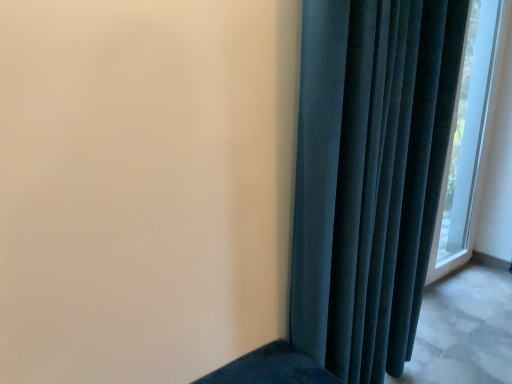
The image size is (512, 384). What do you see at coordinates (369, 176) in the screenshot?
I see `velvet dark blue curtain at right` at bounding box center [369, 176].

Find the location of a particular element. This screenshot has height=384, width=512. velvet dark blue curtain at right is located at coordinates (369, 176).

The width and height of the screenshot is (512, 384). What do you see at coordinates (469, 137) in the screenshot? I see `transparent glass window at right` at bounding box center [469, 137].

Find the location of `transparent glass window at right`. transparent glass window at right is located at coordinates (469, 137).

This screenshot has height=384, width=512. I want to click on velvet dark blue curtain at right, so click(369, 176).

Which is more to the right, velvet dark blue curtain at right or transparent glass window at right?

transparent glass window at right is more to the right.

Which is in front, velvet dark blue curtain at right or transparent glass window at right?

velvet dark blue curtain at right is in front.

Does point (320, 239) appear closer or farther from the camera than point (480, 41)?

Point (320, 239).

From the image's perspective, which is below, velvet dark blue curtain at right or transparent glass window at right?

velvet dark blue curtain at right is shown below in the image.

From a real-world perspective, does velvet dark blue curtain at right stand above transparent glass window at right?

Incorrect, from a real-world perspective, velvet dark blue curtain at right is lower than transparent glass window at right.

Does velvet dark blue curtain at right have a lesser width compared to transparent glass window at right?

In fact, velvet dark blue curtain at right might be wider than transparent glass window at right.

Which of these two, velvet dark blue curtain at right or transparent glass window at right, stands taller?

Standing taller between the two is transparent glass window at right.

Considering the sizes of objects velvet dark blue curtain at right and transparent glass window at right in the image provided, who is smaller, velvet dark blue curtain at right or transparent glass window at right?

Smaller between the two is transparent glass window at right.

Would you say velvet dark blue curtain at right is outside transparent glass window at right?

Yes, velvet dark blue curtain at right is not within transparent glass window at right.

Are velvet dark blue curtain at right and transparent glass window at right far apart?

Absolutely, velvet dark blue curtain at right is distant from transparent glass window at right.

Is velvet dark blue curtain at right turned away from transparent glass window at right?

No.

You are a GUI agent. You are given a task and a screenshot of the screen. Output one action in this format:
    pyautogui.click(x=<x>, y=<y>)
    Task: Click on the window that appears above the velvet dark blue curtain at right (from the image's perspective)
    
    Given the screenshot: What is the action you would take?
    pyautogui.click(x=469, y=137)

Is transparent glass window at right to the right of velvet dark blue curtain at right from the viewer's perspective?

Indeed, transparent glass window at right is positioned on the right side of velvet dark blue curtain at right.

Considering the positions of objects transparent glass window at right and velvet dark blue curtain at right in the image provided, who is behind, transparent glass window at right or velvet dark blue curtain at right?

transparent glass window at right.

Between point (449, 259) and point (456, 36), which one is positioned behind?

The point (449, 259) is farther from the camera.

From the image's perspective, relative to velvet dark blue curtain at right, is transparent glass window at right above or below?

transparent glass window at right is situated higher than velvet dark blue curtain at right in the image.

From a real-world perspective, relative to velvet dark blue curtain at right, is transparent glass window at right vertically above or below?

transparent glass window at right is situated higher than velvet dark blue curtain at right in the real world.

Which object is thinner, transparent glass window at right or velvet dark blue curtain at right?

With smaller width is transparent glass window at right.

From their relative heights in the image, would you say transparent glass window at right is taller or shorter than velvet dark blue curtain at right?

Clearly, transparent glass window at right is taller compared to velvet dark blue curtain at right.

Is transparent glass window at right bigger or smaller than velvet dark blue curtain at right?

transparent glass window at right is smaller than velvet dark blue curtain at right.

Is transparent glass window at right completely or partially outside of velvet dark blue curtain at right?

transparent glass window at right is positioned outside velvet dark blue curtain at right.

Is transparent glass window at right beside velvet dark blue curtain at right?

No.

Does transparent glass window at right turn towards velvet dark blue curtain at right?

No.

How different are the orientations of transparent glass window at right and velvet dark blue curtain at right in degrees?

0.768 degrees separate the facing orientations of transparent glass window at right and velvet dark blue curtain at right.

In the image, there is a transparent glass window at right. Identify the location of curtain below it (from the image's perspective). (369, 176).

This screenshot has width=512, height=384. What are the coordinates of `curtain on the left of the transparent glass window at right` in the screenshot? It's located at (369, 176).

Locate an element on the screen. The height and width of the screenshot is (384, 512). window on the right side of velvet dark blue curtain at right is located at coordinates (469, 137).